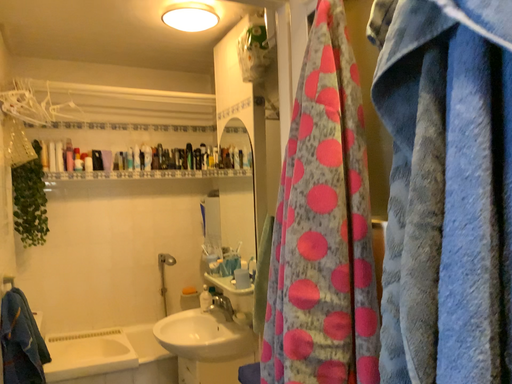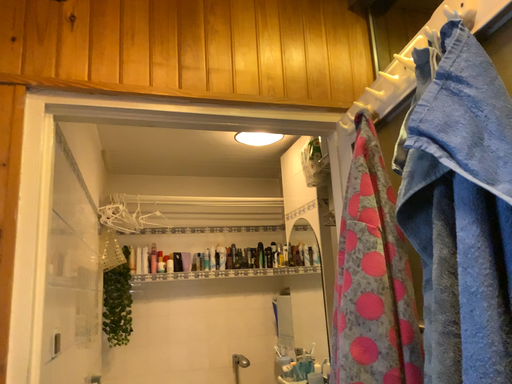
Question: Which way did the camera rotate in the video?

Choices:
 (A) rotated downward
 (B) rotated upward

Answer: (B)